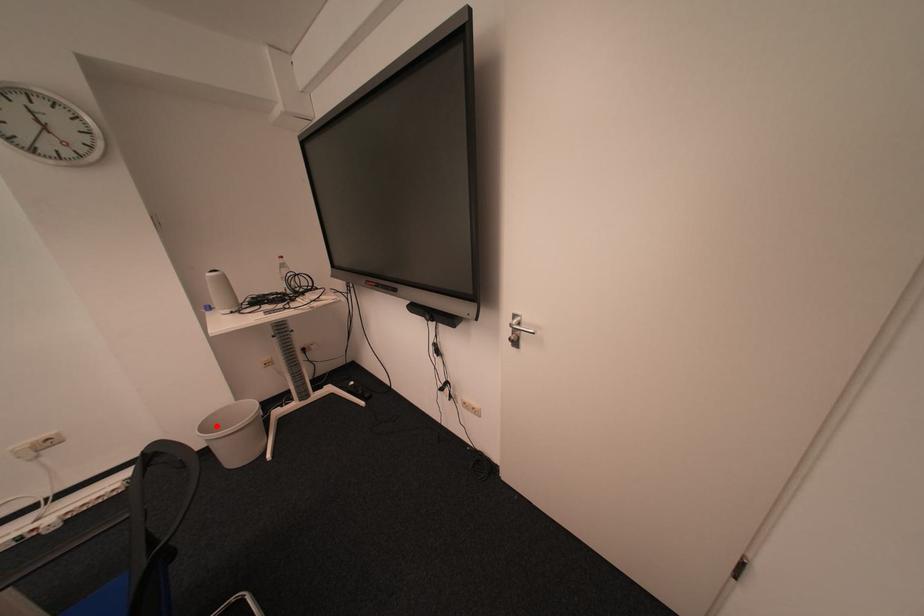
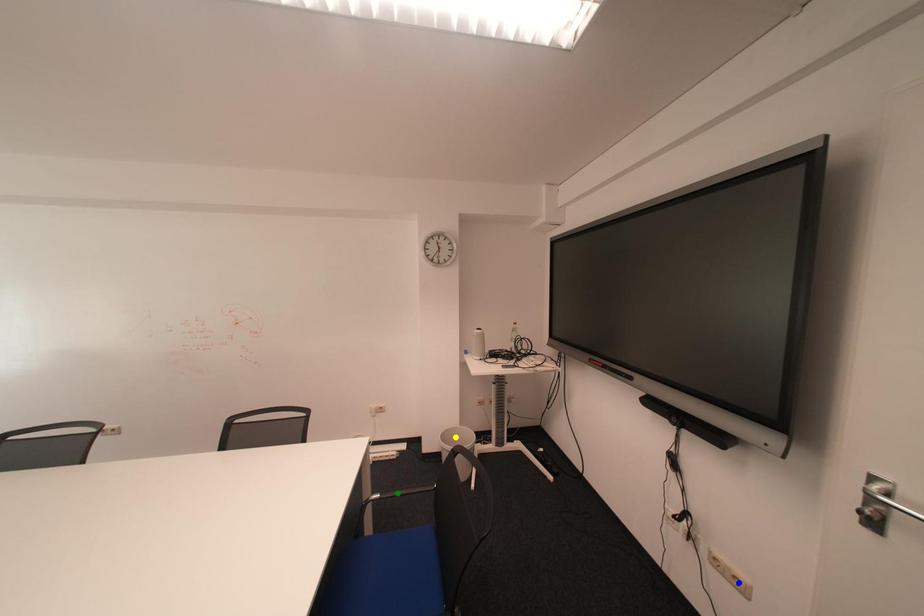
Question: I am providing you with two images of the same scene from different viewpoints. A red point is marked on the first image. You are given multiple points on the second image. Which mark in image 2 goes with the point in image 1?

Choices:
 (A) green point
 (B) yellow point
 (C) blue point

Answer: (B)